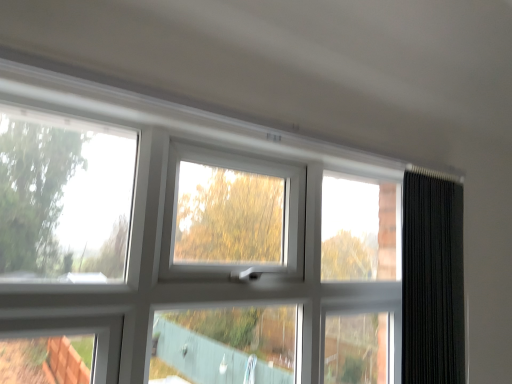
What do you see at coordinates (432, 280) in the screenshot?
I see `black textured curtain at right` at bounding box center [432, 280].

Identify the location of black textured curtain at right. Image resolution: width=512 pixels, height=384 pixels. (432, 280).

Where is `black textured curtain at right`? black textured curtain at right is located at coordinates (432, 280).